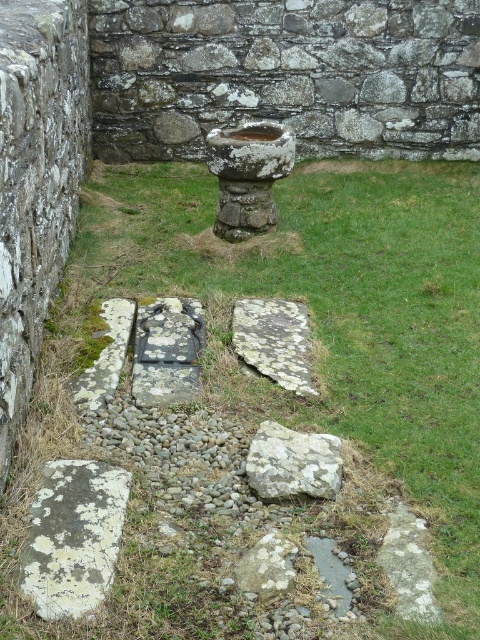
Question: Which point appears farthest from the camera in this image?

Choices:
 (A) (310, 493)
 (B) (133, 307)
 (C) (301, 307)

Answer: (C)

Question: Is lichen-covered stone at lower left below speckled rock at center?

Choices:
 (A) yes
 (B) no

Answer: (A)

Question: Which object appears closest to the camera in this image?

Choices:
 (A) lichen-covered rock at center
 (B) rusty stone bird bath at center

Answer: (A)

Question: Which object is closer to the camera taking this photo?

Choices:
 (A) lichen-covered stone at lower right
 (B) lichen-covered stone at lower left
 (C) green mossy stone at lower left
 (D) speckled stone at center

Answer: (A)

Question: Does speckled stone at center have a larger size compared to lichen-covered stone at lower right?

Choices:
 (A) yes
 (B) no

Answer: (A)

Question: Can you confirm if rusty stone bird bath at center is positioned to the left of speckled stone at center?

Choices:
 (A) no
 (B) yes

Answer: (B)